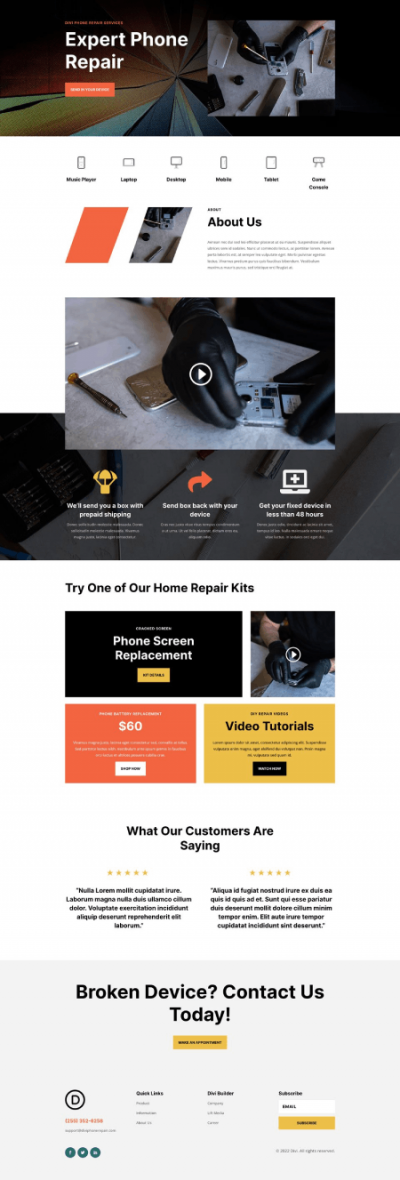
The width and height of the screenshot is (400, 1180). In order to click on table in this screenshot , I will do `click(271, 348)`.